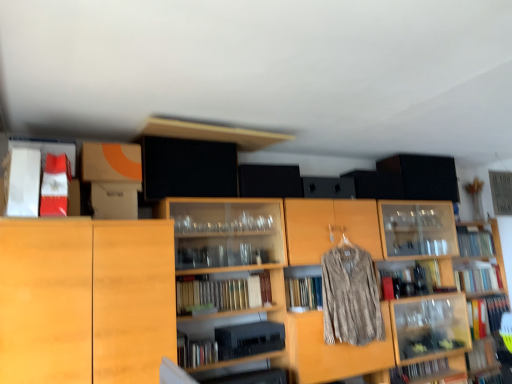
Question: Is light wood cabinet at left at the left side of matte red book at upper left, which ranks as the sixth book in bottom-to-top order?

Choices:
 (A) no
 (B) yes

Answer: (A)

Question: Can you confirm if light wood cabinet at left is wider than matte red book at upper left, which is the 6th book in right-to-left order?

Choices:
 (A) no
 (B) yes

Answer: (B)

Question: Can we say light wood cabinet at left lies outside matte red book at upper left, arranged as the sixth book when viewed from the back?

Choices:
 (A) no
 (B) yes

Answer: (B)

Question: Does light wood cabinet at left have a lesser width compared to matte red book at upper left, which ranks as the sixth book in bottom-to-top order?

Choices:
 (A) no
 (B) yes

Answer: (A)

Question: Considering the relative sizes of light wood cabinet at left and matte red book at upper left, the first book viewed from the top, in the image provided, is light wood cabinet at left taller than matte red book at upper left, the first book viewed from the top,?

Choices:
 (A) no
 (B) yes

Answer: (B)

Question: From the image's perspective, would you say light wood cabinet at left is positioned over matte red book at upper left, placed as the first book when sorted from left to right?

Choices:
 (A) yes
 (B) no

Answer: (B)

Question: Considering the relative sizes of wooden bookshelf at center, the first shelf from the left, and hardcover book at lower right, placed as the 6th book when sorted from top to bottom, in the image provided, is wooden bookshelf at center, the first shelf from the left, smaller than hardcover book at lower right, placed as the 6th book when sorted from top to bottom,?

Choices:
 (A) no
 (B) yes

Answer: (A)

Question: Is wooden bookshelf at center, the 2th shelf from the right, facing towards hardcover book at lower right, marked as the fourth book in a back-to-front arrangement?

Choices:
 (A) yes
 (B) no

Answer: (A)

Question: Is wooden bookshelf at center, the first shelf from the left, shorter than hardcover book at lower right, the first book ordered from the bottom?

Choices:
 (A) no
 (B) yes

Answer: (A)

Question: Is wooden bookshelf at center, the 2th shelf from the right, positioned with its back to hardcover book at lower right, which is the fourth book from right to left?

Choices:
 (A) no
 (B) yes

Answer: (B)

Question: Is wooden bookshelf at center, the first shelf from the left, not near hardcover book at lower right, the first book ordered from the bottom?

Choices:
 (A) no
 (B) yes

Answer: (B)

Question: Are wooden bookshelf at center, the 2th shelf from the right, and hardcover book at lower right, which is the fourth book from right to left, making contact?

Choices:
 (A) no
 (B) yes

Answer: (A)

Question: Does matte red book at upper left, which is the 6th book in right-to-left order, have a greater height compared to wooden bookshelf at center, the first shelf from the left?

Choices:
 (A) no
 (B) yes

Answer: (A)